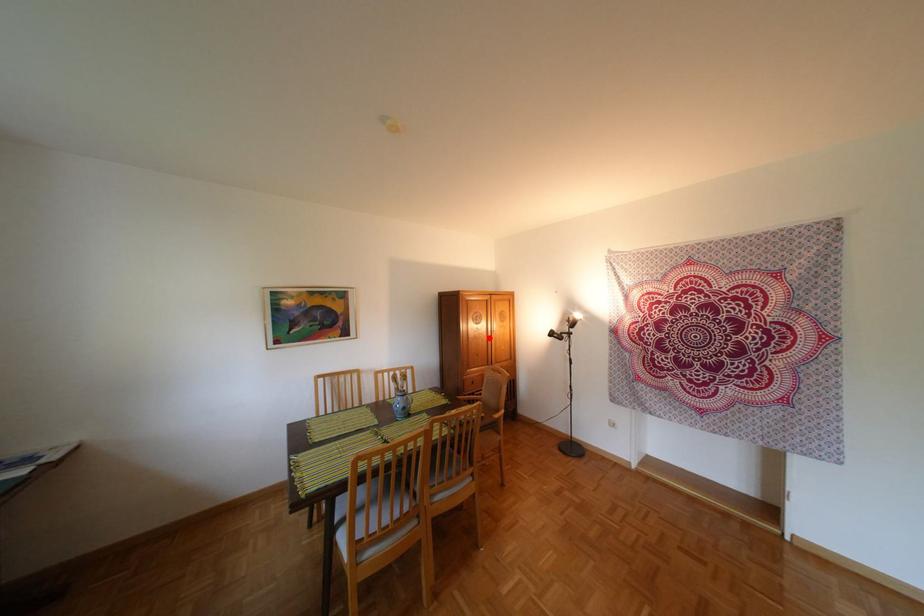
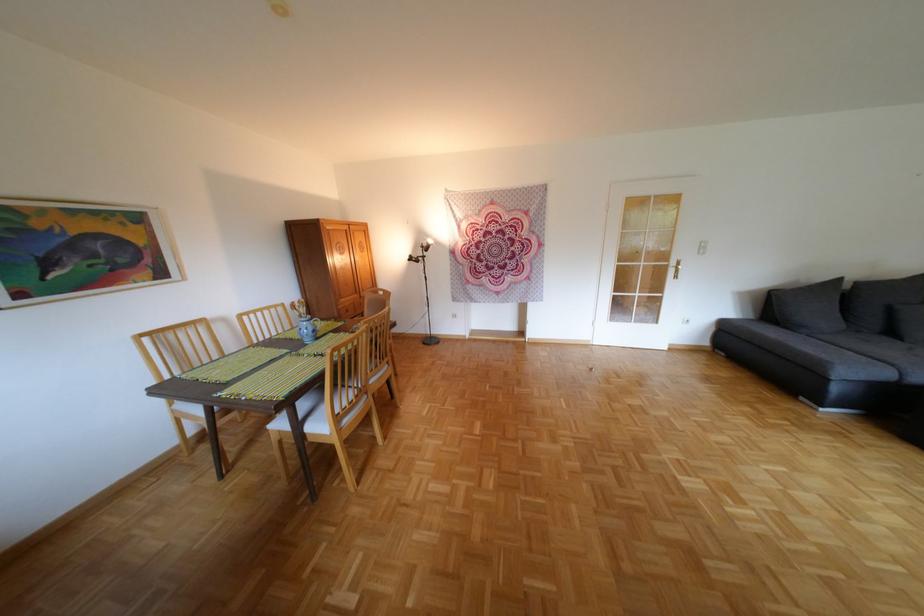
Question: A red point is marked in image1. In image2, is the corresponding 3D point closer to the camera or farther? Reply with the corresponding letter.

Choices:
 (A) The corresponding 3D point is closer.
 (B) The corresponding 3D point is farther.

Answer: (A)